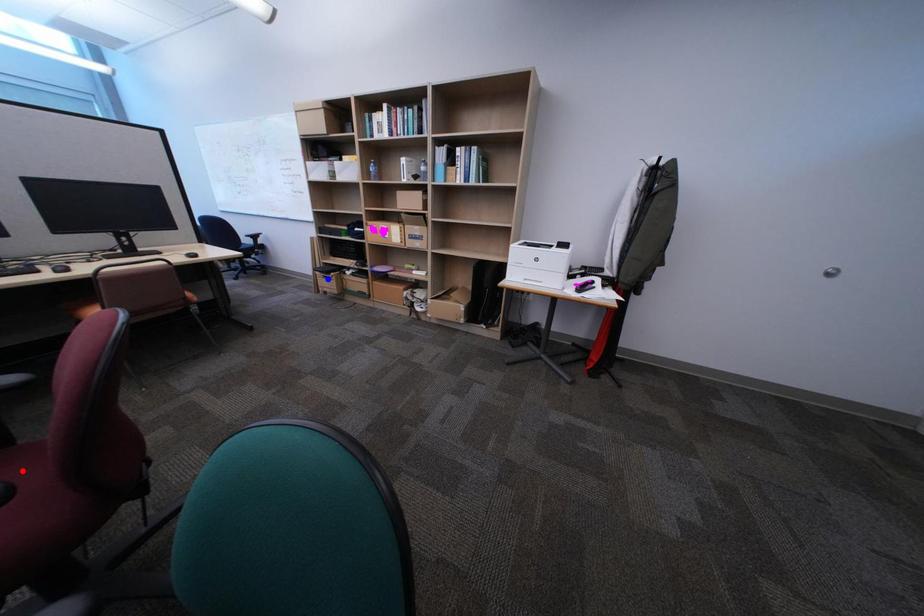
Question: Which of the two points in the image is closer to the camera?

Choices:
 (A) Blue point is closer.
 (B) Red point is closer.

Answer: (B)